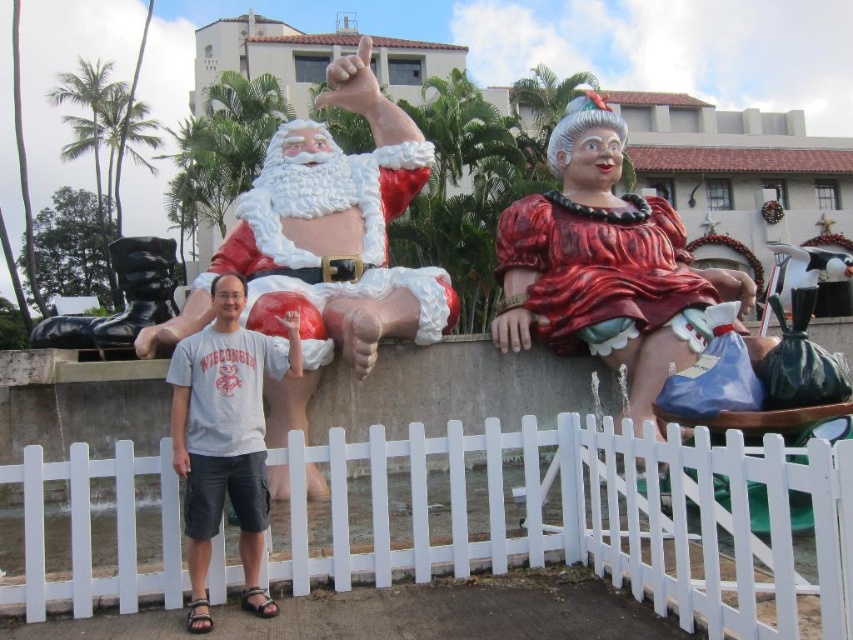
Can you confirm if matte plastic santa at upper center is smaller than gray cotton t-shirt at center?

Incorrect, matte plastic santa at upper center is not smaller in size than gray cotton t-shirt at center.

Identify the location of matte plastic santa at upper center. This screenshot has height=640, width=853. (326, 244).

Which is behind, point (294, 387) or point (219, 420)?

The point (294, 387) is behind.

The image size is (853, 640). Identify the location of matte plastic santa at upper center. (326, 244).

How far apart are white plastic picket fence at lower center and matte plastic santa at upper center?

white plastic picket fence at lower center and matte plastic santa at upper center are 7.96 meters apart from each other.

Is point (583, 428) less distant than point (434, 275)?

Yes, point (583, 428) is closer to viewer.

Locate an element on the screen. The width and height of the screenshot is (853, 640). white plastic picket fence at lower center is located at coordinates (601, 518).

The image size is (853, 640). In order to click on white plastic picket fence at lower center in this screenshot , I will do `click(601, 518)`.

Can you confirm if white plastic picket fence at lower center is thinner than gray cotton t-shirt at center?

In fact, white plastic picket fence at lower center might be wider than gray cotton t-shirt at center.

Who is lower down, white plastic picket fence at lower center or gray cotton t-shirt at center?

Positioned lower is white plastic picket fence at lower center.

Which is behind, point (576, 483) or point (178, 438)?

Point (576, 483)

This screenshot has width=853, height=640. I want to click on white plastic picket fence at lower center, so click(601, 518).